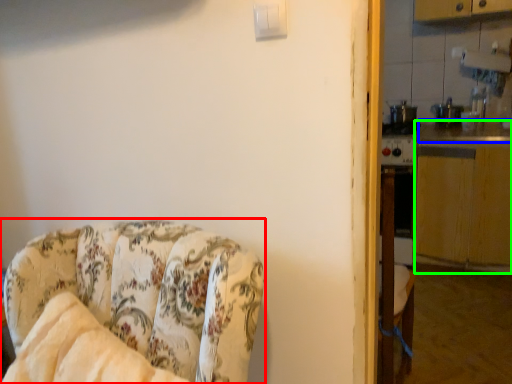
Question: Estimate the real-world distances between objects in this image. Which object is closer to chair (highlighted by a red box), counter top (highlighted by a blue box) or counter top (highlighted by a green box)?

Choices:
 (A) counter top
 (B) counter top

Answer: (B)